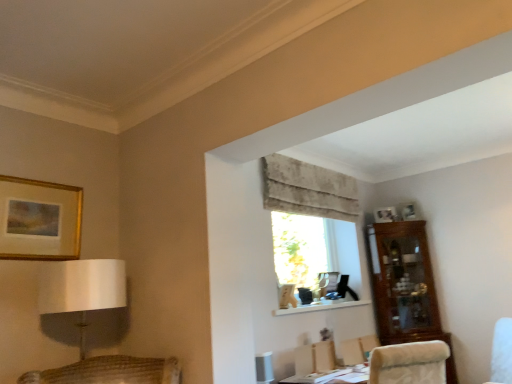
Question: Is beige textured curtain at upper center bigger or smaller than matte silver picture frame at upper right, marked as the 2th picture frame in a right-to-left arrangement?

Choices:
 (A) big
 (B) small

Answer: (A)

Question: Is point (354, 200) positioned closer to the camera than point (373, 215)?

Choices:
 (A) closer
 (B) farther

Answer: (A)

Question: Considering the real-world distances, which object is closest to the translucent fabric window at center?

Choices:
 (A) velvet beige armchair at lower right
 (B) gold/glossy picture frame at upper left, which is the 3th picture frame from back to front
 (C) matte silver picture frame at upper right, which ranks as the second picture frame in back-to-front order
 (D) white matte shelf at center
 (E) white glossy picture frame at upper right, arranged as the third picture frame when viewed from the left

Answer: (D)

Question: Estimate the real-world distances between objects in this image. Which object is closer to the beige textured curtain at upper center?

Choices:
 (A) gold/glossy picture frame at upper left, which is the 3th picture frame from back to front
 (B) velvet beige armchair at lower right
 (C) translucent fabric window at center
 (D) white matte shelf at center
 (E) matte silver picture frame at upper right, which ranks as the second picture frame in back-to-front order

Answer: (C)